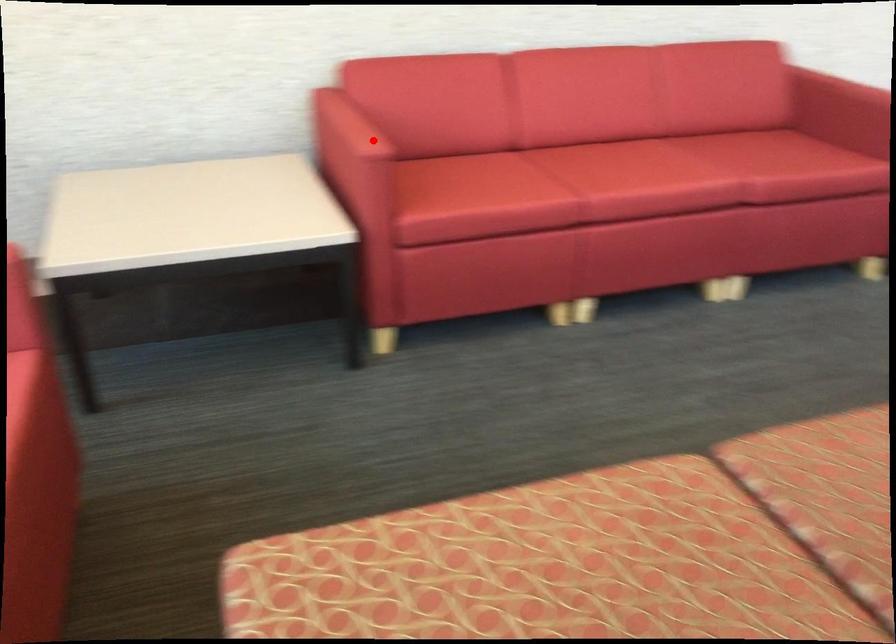
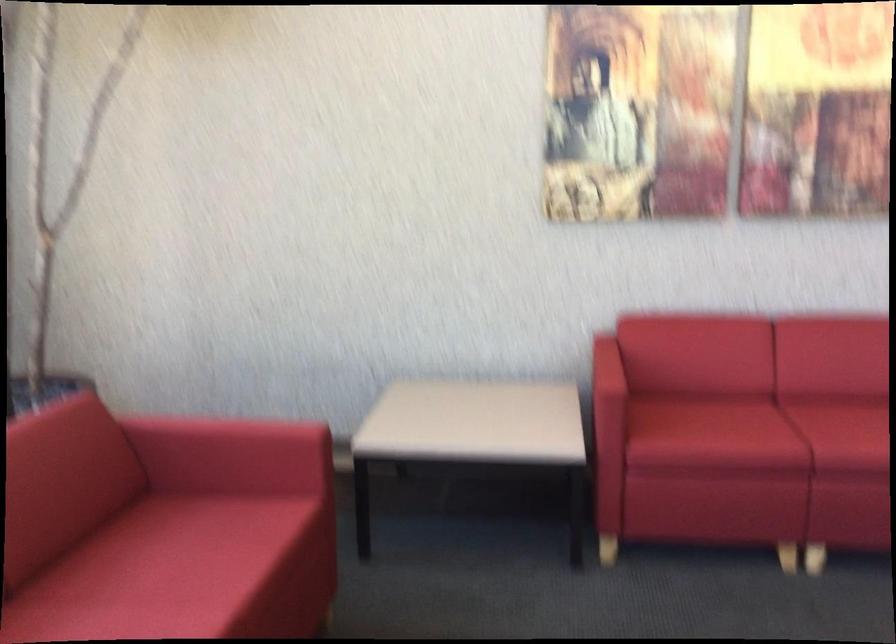
Locate, in the second image, the point that corresponds to the highlighted location in the first image.

(607, 377)